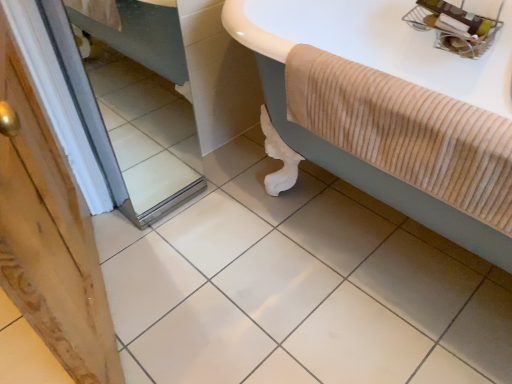
At what (x,y) coordinates should I click in order to perform the action: click on white glossy ceramic tile at center. Please return your answer as a coordinate pair (x, y). The width and height of the screenshot is (512, 384). Looking at the image, I should click on (298, 287).

Describe the element at coordinates (146, 111) in the screenshot. The image size is (512, 384). I see `mirror at left` at that location.

You are a GUI agent. You are given a task and a screenshot of the screen. Output one action in this format:
    pyautogui.click(x=<x>, y=<y>)
    Task: Click on the white glossy ceramic tile at center
    The image size is (512, 384).
    Given the screenshot: What is the action you would take?
    pyautogui.click(x=298, y=287)

Can you confirm if beige corduroy bathtub at upper right is wider than white glossy ceramic tile at center?

Incorrect, the width of beige corduroy bathtub at upper right does not surpass that of white glossy ceramic tile at center.

Considering the relative sizes of beige corduroy bathtub at upper right and white glossy ceramic tile at center in the image provided, is beige corduroy bathtub at upper right bigger than white glossy ceramic tile at center?

Actually, beige corduroy bathtub at upper right might be smaller than white glossy ceramic tile at center.

From their relative heights in the image, would you say beige corduroy bathtub at upper right is taller or shorter than white glossy ceramic tile at center?

Considering their sizes, beige corduroy bathtub at upper right has more height than white glossy ceramic tile at center.

Is beige corduroy bathtub at upper right not close to white glossy ceramic tile at center?

No, beige corduroy bathtub at upper right is in close proximity to white glossy ceramic tile at center.

From a real-world perspective, is mirror at left over white glossy ceramic tile at center?

Indeed, from a real-world perspective, mirror at left stands above white glossy ceramic tile at center.

Looking at the image, does mirror at left seem bigger or smaller compared to white glossy ceramic tile at center?

Clearly, mirror at left is smaller in size than white glossy ceramic tile at center.

Which object is positioned more to the right, mirror at left or white glossy ceramic tile at center?

From the viewer's perspective, white glossy ceramic tile at center appears more on the right side.

Is mirror at left taller than white glossy ceramic tile at center?

Indeed, mirror at left has a greater height compared to white glossy ceramic tile at center.

In the image, is beige corduroy bathtub at upper right positioned in front of or behind mirror at left?

beige corduroy bathtub at upper right is in front of mirror at left.

Image resolution: width=512 pixels, height=384 pixels. What are the coordinates of `bathtub below the mirror at left (from the image's perspective)` in the screenshot? It's located at (384, 71).

Looking at this image, which object is positioned more to the right, beige corduroy bathtub at upper right or mirror at left?

Positioned to the right is beige corduroy bathtub at upper right.

From the image's perspective, who appears lower, beige corduroy bathtub at upper right or mirror at left?

beige corduroy bathtub at upper right, from the image's perspective.

Considering the relative sizes of mirror at left and beige corduroy bathtub at upper right in the image provided, is mirror at left shorter than beige corduroy bathtub at upper right?

In fact, mirror at left may be taller than beige corduroy bathtub at upper right.

Looking at this image, considering the positions of objects mirror at left and beige corduroy bathtub at upper right in the image provided, who is more to the left, mirror at left or beige corduroy bathtub at upper right?

Positioned to the left is mirror at left.

From the image's perspective, between mirror at left and beige corduroy bathtub at upper right, which one is located above?

mirror at left is shown above in the image.

Does mirror at left lie in front of beige corduroy bathtub at upper right?

That is False.

Based on their sizes in the image, would you say white glossy ceramic tile at center is bigger or smaller than mirror at left?

In the image, white glossy ceramic tile at center appears to be larger than mirror at left.

From a real-world perspective, between white glossy ceramic tile at center and mirror at left, who is vertically lower?

white glossy ceramic tile at center, from a real-world perspective.

Is white glossy ceramic tile at center thinner than mirror at left?

No, white glossy ceramic tile at center is not thinner than mirror at left.

Are white glossy ceramic tile at center and mirror at left located far from each other?

No, there isn't a large distance between white glossy ceramic tile at center and mirror at left.

Based on the photo, from the image's perspective, which one is positioned higher, white glossy ceramic tile at center or beige corduroy bathtub at upper right?

beige corduroy bathtub at upper right.

Is white glossy ceramic tile at center shorter than beige corduroy bathtub at upper right?

Yes.

From a real-world perspective, is white glossy ceramic tile at center located beneath beige corduroy bathtub at upper right?

Correct, in the physical world, white glossy ceramic tile at center is lower than beige corduroy bathtub at upper right.

In the image, is white glossy ceramic tile at center positioned in front of or behind beige corduroy bathtub at upper right?

Clearly, white glossy ceramic tile at center is in front of beige corduroy bathtub at upper right.

Locate an element on the screen. ceramic tile below the beige corduroy bathtub at upper right (from a real-world perspective) is located at coordinates click(298, 287).

Locate an element on the screen. mirror above the white glossy ceramic tile at center (from a real-world perspective) is located at coordinates (146, 111).

When comparing their distances from white glossy ceramic tile at center, does beige corduroy bathtub at upper right or mirror at left seem closer?

mirror at left is closer to white glossy ceramic tile at center.

When comparing their distances from beige corduroy bathtub at upper right, does white glossy ceramic tile at center or mirror at left seem closer?

white glossy ceramic tile at center is positioned closer to the anchor beige corduroy bathtub at upper right.

When comparing their distances from white glossy ceramic tile at center, does mirror at left or beige corduroy bathtub at upper right seem further?

beige corduroy bathtub at upper right.

Which object lies further to the anchor point beige corduroy bathtub at upper right, mirror at left or white glossy ceramic tile at center?

Result: Among the two, mirror at left is located further to beige corduroy bathtub at upper right.

Based on their spatial positions, is white glossy ceramic tile at center or beige corduroy bathtub at upper right closer to mirror at left?

Among the two, white glossy ceramic tile at center is located nearer to mirror at left.

Based on their spatial positions, is beige corduroy bathtub at upper right or white glossy ceramic tile at center closer to mirror at left?

The object closer to mirror at left is white glossy ceramic tile at center.

The width and height of the screenshot is (512, 384). I want to click on ceramic tile situated between mirror at left and beige corduroy bathtub at upper right from left to right, so click(x=298, y=287).